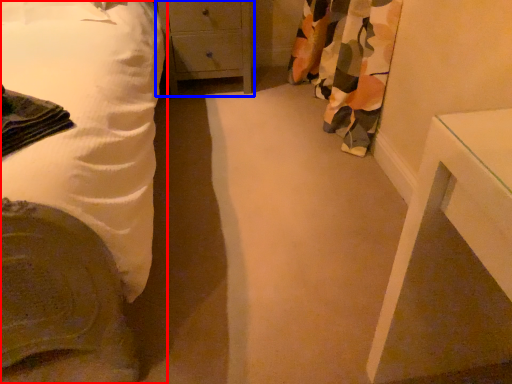
Question: Which object appears closest to the camera in this image, bed (highlighted by a red box) or chest of drawers (highlighted by a blue box)?

Choices:
 (A) bed
 (B) chest of drawers

Answer: (A)